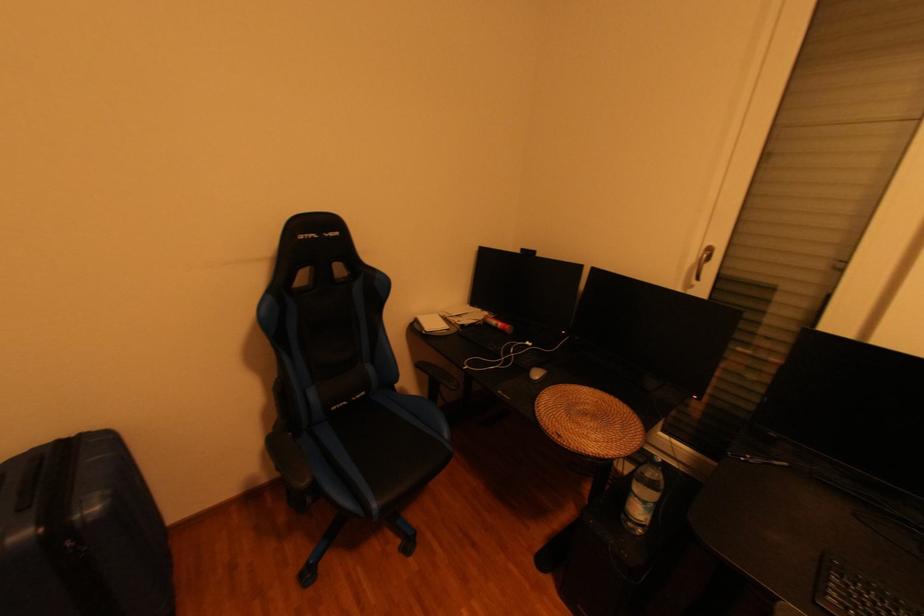
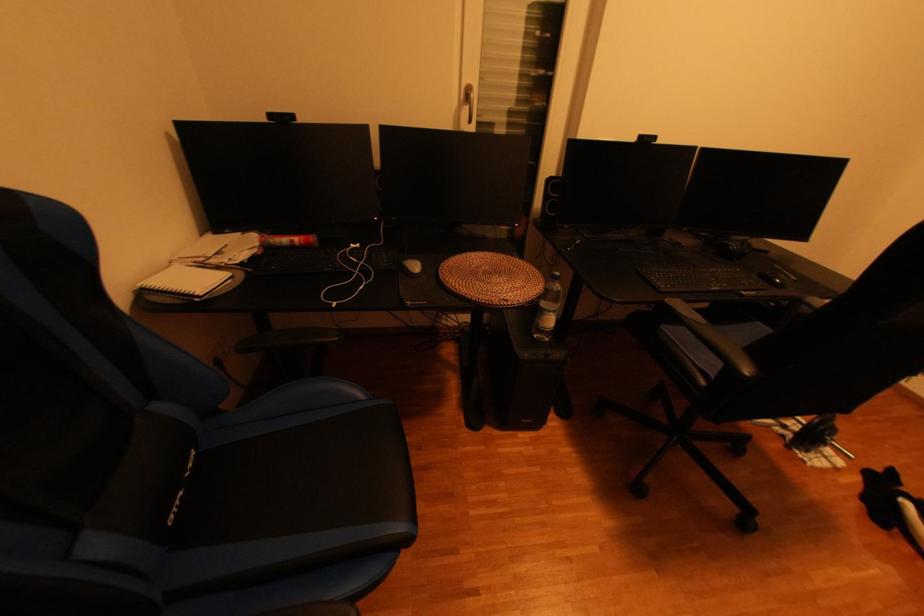
The point at (537, 254) is marked in the first image. Where is the corresponding point in the second image?

(294, 121)